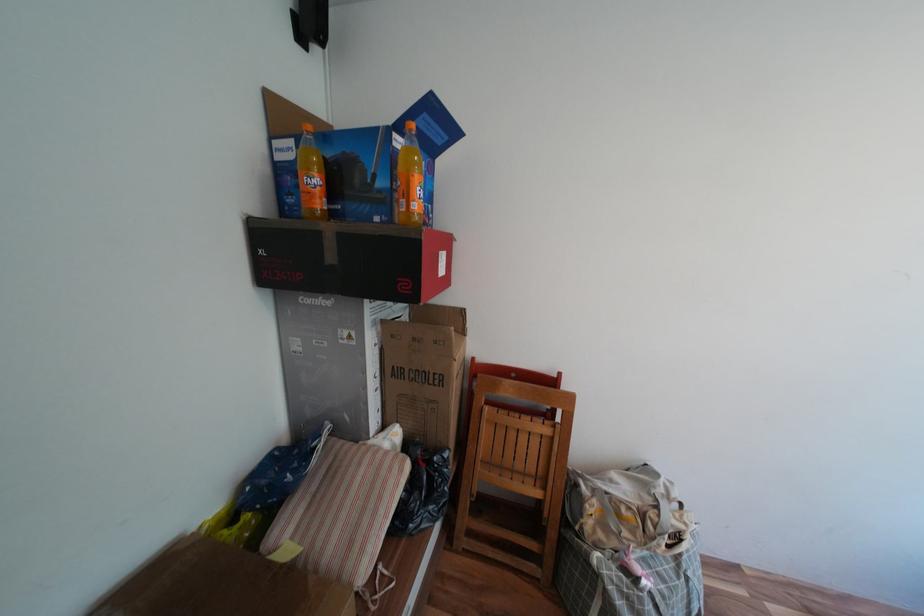
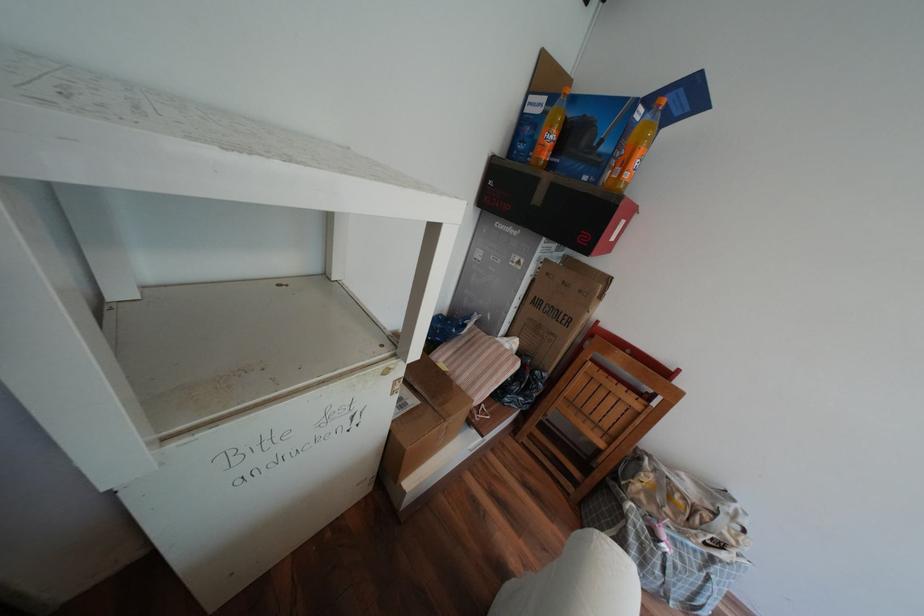
Where in the second image is the point corresponding to point (399, 469) from the first image?

(517, 360)